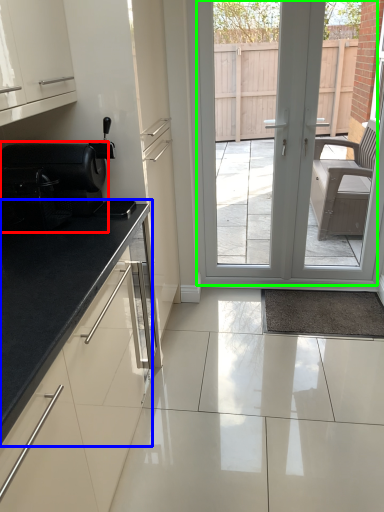
Question: Which is nearer to the appliance (highlighted by a red box)? countertop (highlighted by a blue box) or door (highlighted by a green box).

Choices:
 (A) countertop
 (B) door

Answer: (A)